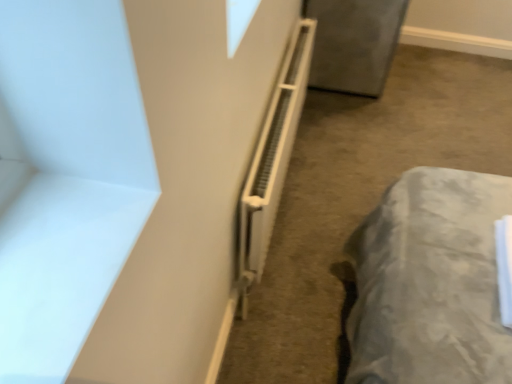
Locate an element on the screen. The width and height of the screenshot is (512, 384). vacant area in front of white matte radiator at center is located at coordinates (298, 278).